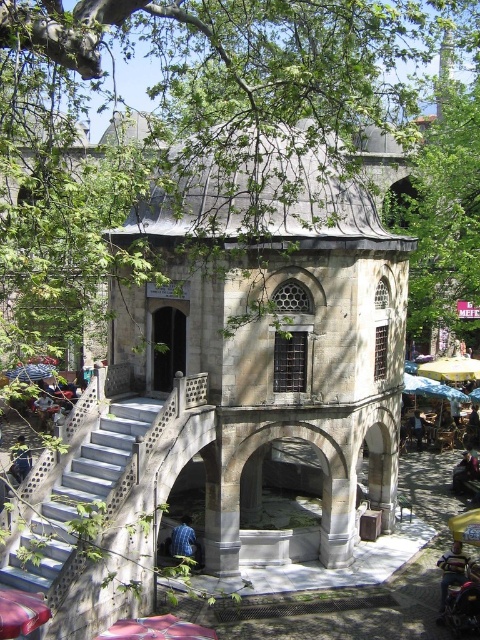
Question: Considering the real-world distances, which object is farthest from the white concrete stairs at lower left?

Choices:
 (A) yellow fabric canopy at lower right
 (B) green leafy tree at upper left
 (C) metallic red car at lower left
 (D) metallic pink car at lower center

Answer: (A)

Question: Is stone gazebo at center further to the viewer compared to metallic red car at lower left?

Choices:
 (A) yes
 (B) no

Answer: (A)

Question: Based on their relative distances, which object is nearer to the yellow fabric canopy at lower right?

Choices:
 (A) stone gazebo at center
 (B) metallic red car at lower left

Answer: (A)

Question: From the image, what is the correct spatial relationship of stone gazebo at center in relation to white concrete stairs at lower left?

Choices:
 (A) right
 (B) left

Answer: (A)

Question: Is white concrete stairs at lower left above metallic red car at lower left?

Choices:
 (A) yes
 (B) no

Answer: (A)

Question: Which of the following is the closest to the observer?

Choices:
 (A) (250, 554)
 (B) (156, 628)
 (C) (15, 570)

Answer: (B)